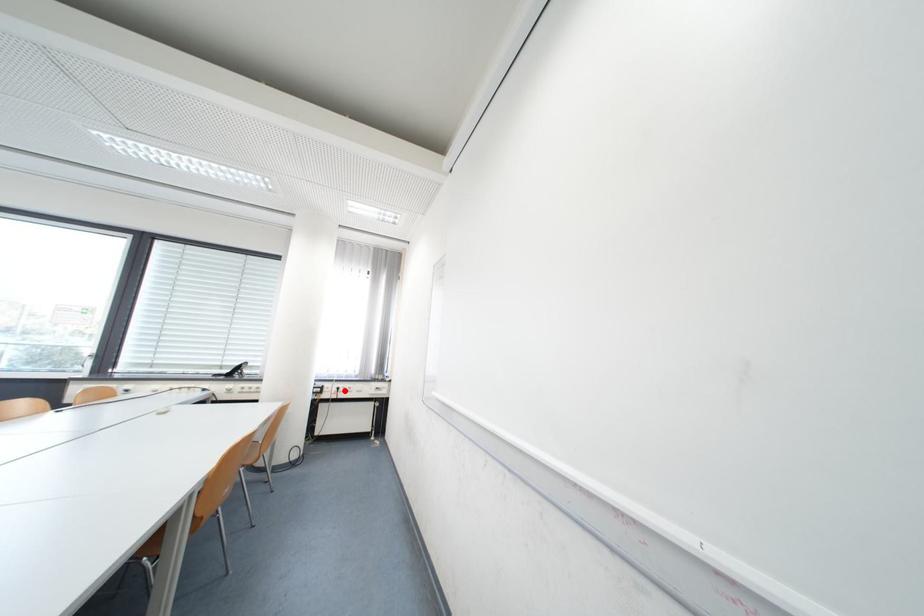
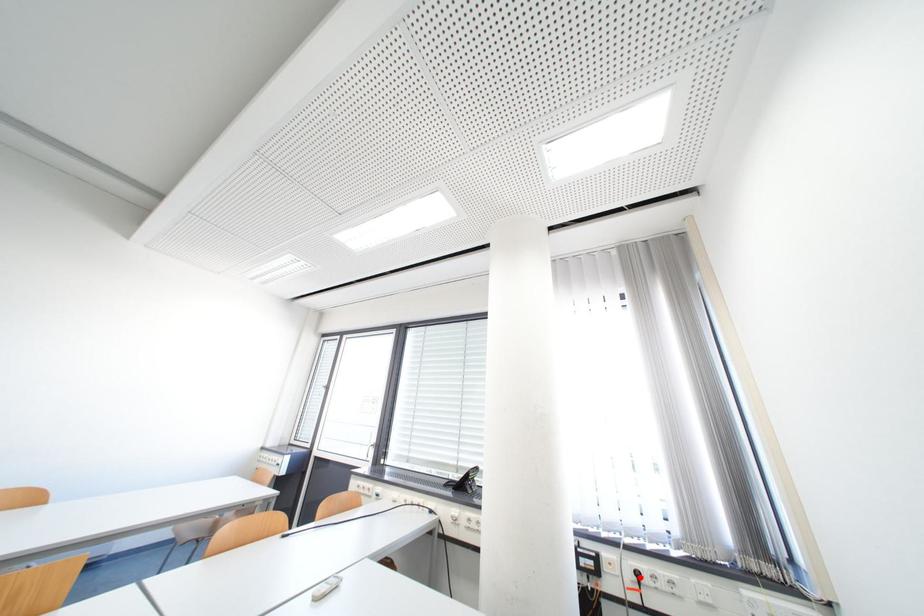
I am providing you with two images of the same scene from different viewpoints. A red point is marked on the first image and another point is marked on the second image. Is the marked point in image1 the same physical position as the marked point in image2?

Yes